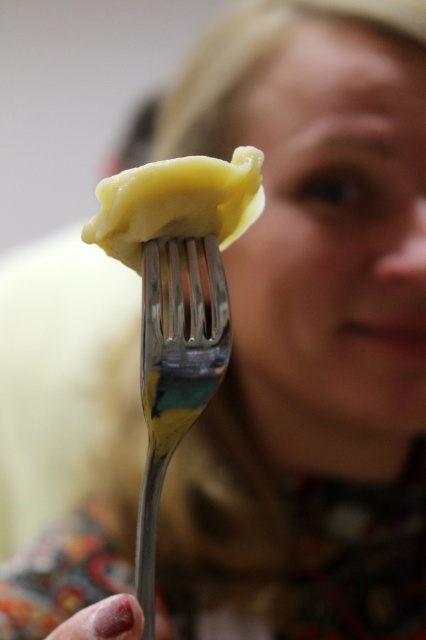
You are trying to place a small sticker on either the point at (x=207, y=403) or the point at (x=253, y=154) in the image. Which point is closer to the viewer?

Point at (x=207, y=403) is in front of point at (x=253, y=154), so it is closer to the viewer.

You are a food critic evaluating the presentation of this dish. Based on the image, can you determine the spatial relationship between the silver metallic fork at center and the yellow matte dumpling at center?

The silver metallic fork at center is located below the yellow matte dumpling at center, which means the fork is positioned underneath the dumpling in the image.